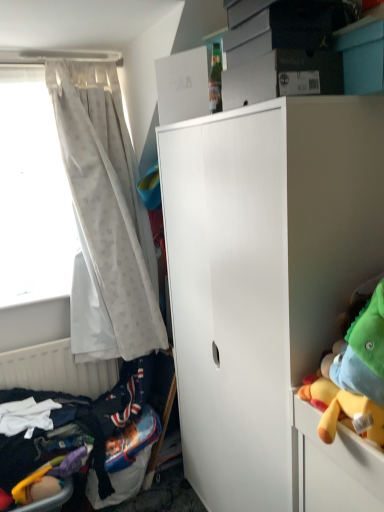
Question: Is white matte cabinet at center closer to camera compared to dark blue fabric bed at lower left?

Choices:
 (A) no
 (B) yes

Answer: (B)

Question: Does white matte cabinet at center have a greater height compared to dark blue fabric bed at lower left?

Choices:
 (A) yes
 (B) no

Answer: (A)

Question: From the image's perspective, is white matte cabinet at center beneath dark blue fabric bed at lower left?

Choices:
 (A) yes
 (B) no

Answer: (B)

Question: From the image's perspective, does white matte cabinet at center appear higher than dark blue fabric bed at lower left?

Choices:
 (A) yes
 (B) no

Answer: (A)

Question: Is white matte cabinet at center smaller than dark blue fabric bed at lower left?

Choices:
 (A) no
 (B) yes

Answer: (A)

Question: Is dark blue fabric bed at lower left completely or partially inside white matte cabinet at center?

Choices:
 (A) no
 (B) yes

Answer: (A)

Question: From a real-world perspective, is white sheer curtain at left on white matte cabinet at center?

Choices:
 (A) yes
 (B) no

Answer: (A)

Question: From a real-world perspective, does white sheer curtain at left sit lower than white matte cabinet at center?

Choices:
 (A) no
 (B) yes

Answer: (A)

Question: Can you confirm if white sheer curtain at left is wider than white matte cabinet at center?

Choices:
 (A) yes
 (B) no

Answer: (B)

Question: Is white sheer curtain at left completely or partially outside of white matte cabinet at center?

Choices:
 (A) yes
 (B) no

Answer: (A)

Question: From the image's perspective, is white sheer curtain at left on white matte cabinet at center?

Choices:
 (A) no
 (B) yes

Answer: (B)

Question: Considering the relative positions of white sheer curtain at left and white matte cabinet at center in the image provided, is white sheer curtain at left behind white matte cabinet at center?

Choices:
 (A) no
 (B) yes

Answer: (B)

Question: From the image's perspective, would you say white matte radiator at lower left is shown under dark blue fabric bed at lower left?

Choices:
 (A) no
 (B) yes

Answer: (A)